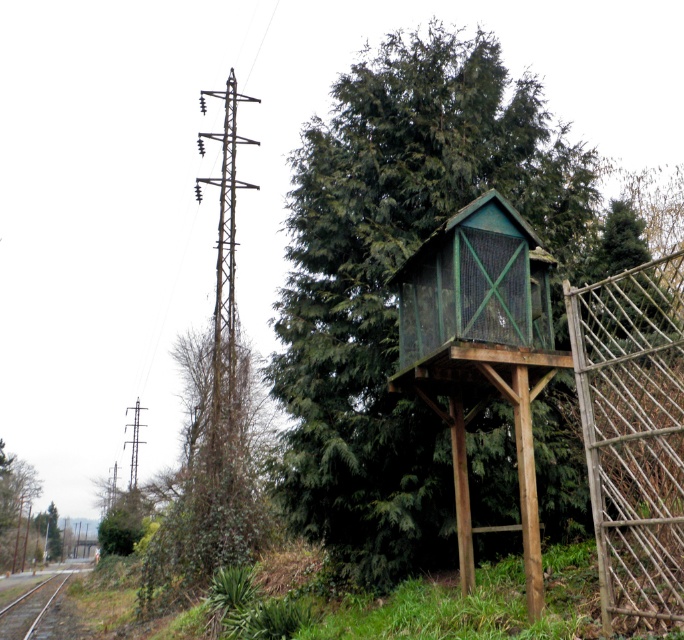
You are a bird trying to land on the green wooden birdhouse at center. The metallic wire at left is nearby. Which object has a smaller width when viewed from above?

The green wooden birdhouse at center is thinner than the metallic wire at left, so the green wooden birdhouse at center has a smaller width when viewed from above.

You are a bird looking for a place to rest. You see the green wooden birdhouse at center and the smooth metal train track at lower left. Which option offers a smaller area for resting?

The green wooden birdhouse at center offers a smaller resting area since it occupies less space than the smooth metal train track at lower left.

You are standing at the base of the green wooden birdhouse at center, which is 6.89 meters tall. You want to place a 2.5 meter ladder against it to reach the top. Will the ladder be long enough?

The green wooden birdhouse at center is 6.89 meters tall. A 2.5 meter ladder is much shorter than the height of the birdhouse, so it will not be long enough to reach the top.